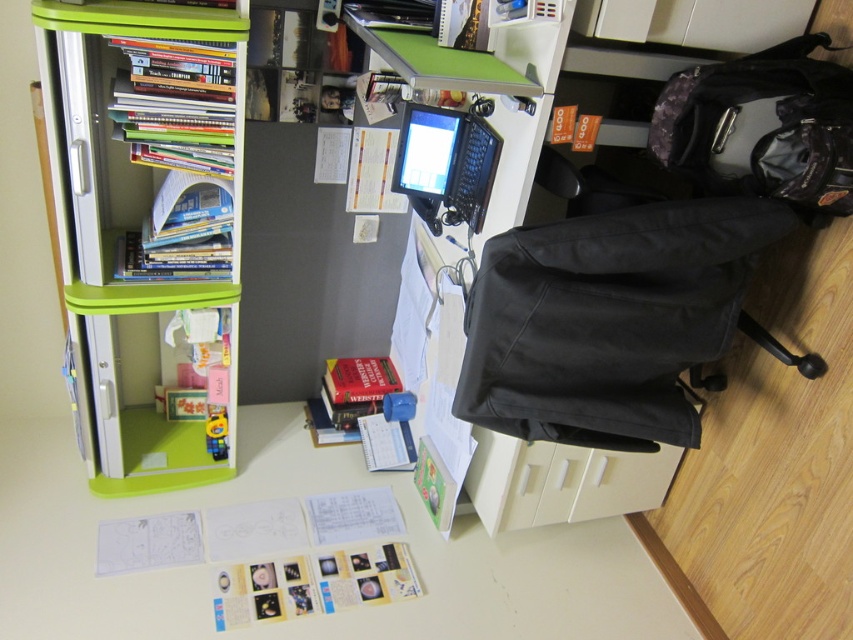
You are organizing your workspace and need to move the camouflage fabric backpack at right to make more space. Based on its current position, which area of the desk would it occupy if moved directly forward?

The camouflage fabric backpack at right is located at point (762,125), so moving it directly forward would place it near the lower right corner of the desk.

You are organizing your office and need to move the camouflage fabric backpack at right closer to the green plastic bookshelf at left. The backpack is 0.5 meters wide. Can you move it so that there is at least 0.3 meters of space between the backpack and the bookshelf?

The distance between the green plastic bookshelf at left and camouflage fabric backpack at right is currently 1.09 meters. If you move the backpack closer so that it is 0.3 meters away from the bookshelf, there will still be 1.09m minus 0.3m equals 0.79 meters remaining space. However, the question asks if you can have at least 0.3 meters between them after moving. Since the backpack is 0.5 meters wide, the total required space would be 0.5m backpack width plus 0.3m spacing equals 0.8 meters. The current 1.